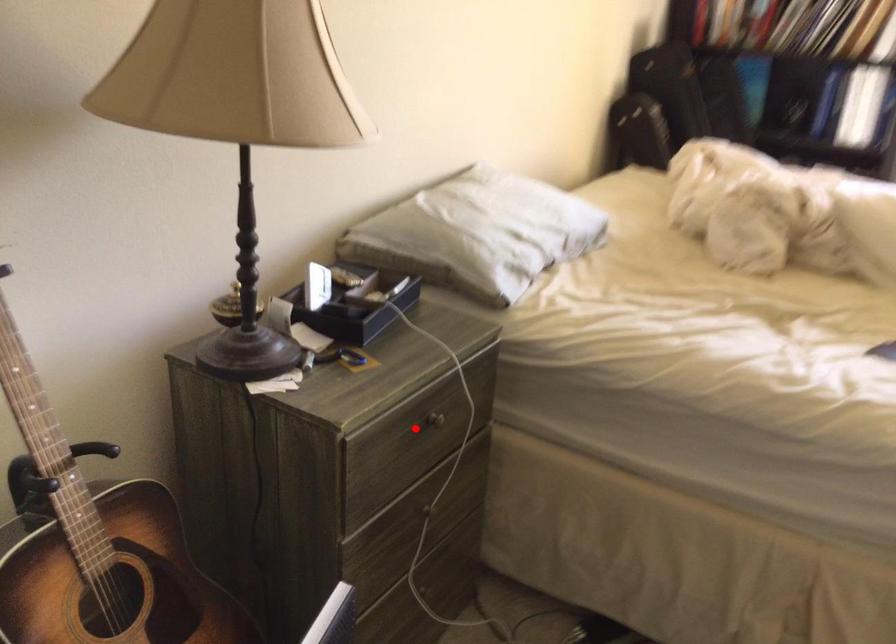
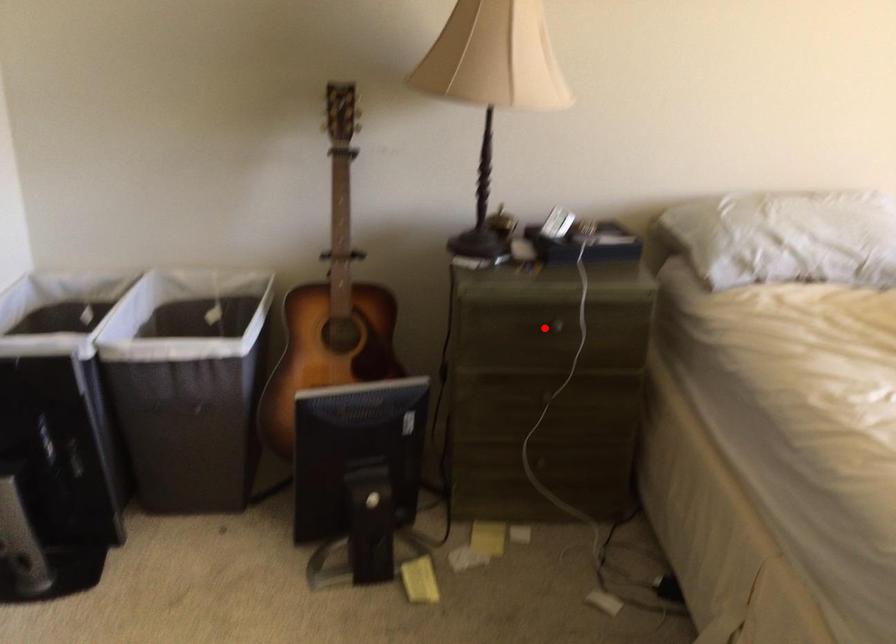
I am providing you with two images of the same scene from different viewpoints. A red point is marked on the first image and another point is marked on the second image. Is the red point in image1 aligned with the point shown in image2?

Yes